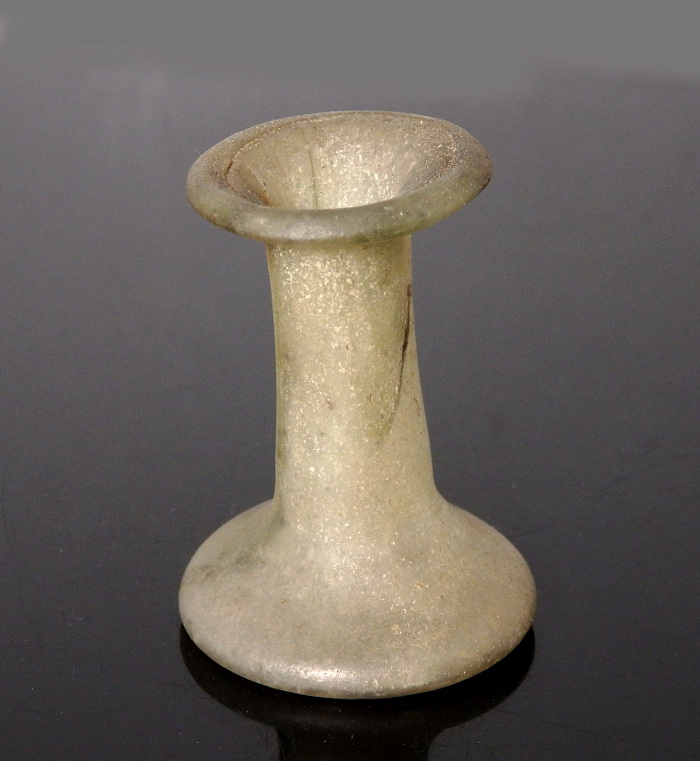
This screenshot has height=761, width=700. In order to click on light grey table half way down from top in this screenshot , I will do `click(83, 40)`, `click(615, 39)`, `click(370, 34)`, `click(103, 242)`, `click(615, 252)`.